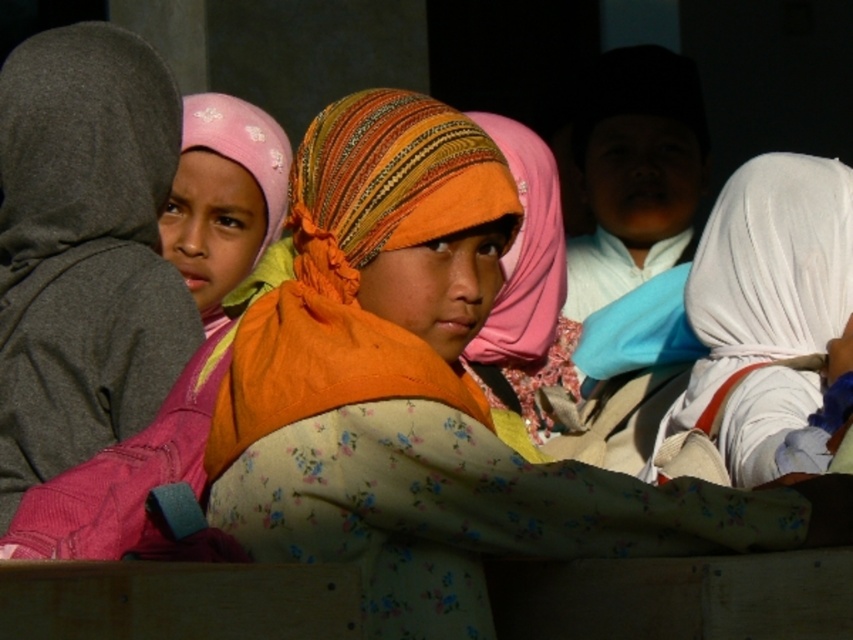
Which is more to the right, orange fabric headscarf at center or orange woven headscarf at center?

Positioned to the right is orange woven headscarf at center.

The width and height of the screenshot is (853, 640). Describe the element at coordinates (358, 266) in the screenshot. I see `orange fabric headscarf at center` at that location.

Who is more distant from viewer, [461,220] or [537,323]?

The point [537,323] is more distant.

Locate an element on the screen. orange fabric headscarf at center is located at coordinates (358, 266).

Can you confirm if floral fabric headscarf at center is smaller than pink fabric headscarf at left?

Incorrect, floral fabric headscarf at center is not smaller in size than pink fabric headscarf at left.

Does floral fabric headscarf at center have a lesser width compared to pink fabric headscarf at left?

In fact, floral fabric headscarf at center might be wider than pink fabric headscarf at left.

Measure the distance between point (477, 604) and camera.

Point (477, 604) is 20.10 meters away from camera.

Identify the location of floral fabric headscarf at center. The height and width of the screenshot is (640, 853). tap(427, 394).

The width and height of the screenshot is (853, 640). What are the coordinates of `floral fabric headscarf at center` in the screenshot? It's located at (427, 394).

Can you confirm if floral fabric headscarf at center is positioned to the right of orange woven headscarf at center?

Incorrect, floral fabric headscarf at center is not on the right side of orange woven headscarf at center.

Between point (454, 509) and point (512, 296), which one is positioned behind?

Positioned behind is point (512, 296).

Find the location of `floral fabric headscarf at center`. floral fabric headscarf at center is located at coordinates (427, 394).